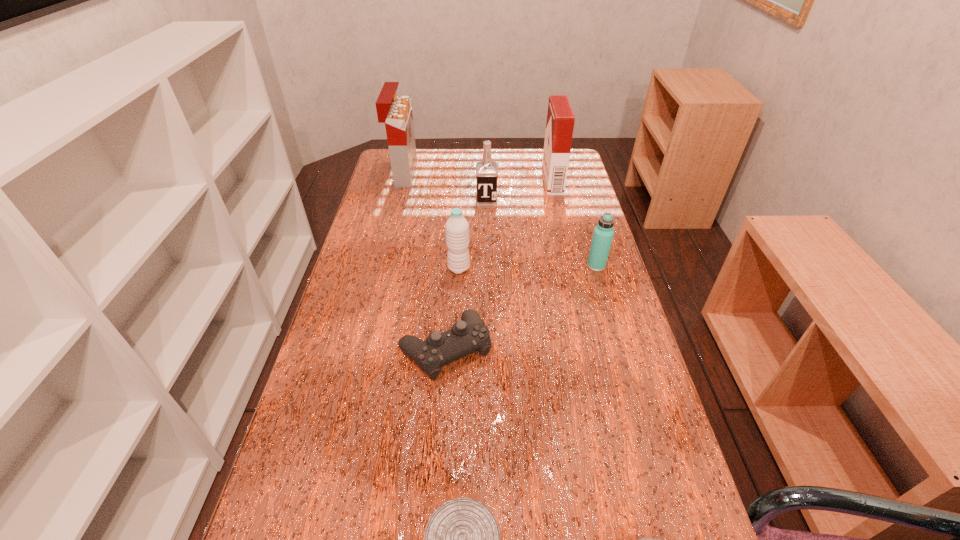
Locate an element on the screen. the leftmost object is located at coordinates (396, 112).

Identify the location of the right cigarette_case. This screenshot has height=540, width=960. (560, 118).

At what (x,y) coordinates should I click in order to perform the action: click on vodka. Please return your answer as a coordinate pair (x, y). Looking at the image, I should click on (486, 170).

You are a GUI agent. You are given a task and a screenshot of the screen. Output one action in this format:
    pyautogui.click(x=<x>, y=<y>)
    Task: Click on the water bottle
    The height and width of the screenshot is (540, 960).
    Given the screenshot: What is the action you would take?
    pyautogui.click(x=457, y=227)

At what (x,y) coordinates should I click in order to perform the action: click on thermos bottle. Please return your answer as a coordinate pair (x, y). Looking at the image, I should click on (603, 233).

You are a GUI agent. You are given a task and a screenshot of the screen. Output one action in this format:
    pyautogui.click(x=<x>, y=<y>)
    Task: Click on the control
    
    Given the screenshot: What is the action you would take?
    pyautogui.click(x=469, y=335)

Where is `the second shortest object`? This screenshot has width=960, height=540. the second shortest object is located at coordinates (469, 335).

The image size is (960, 540). Find the location of `vacant space located 0.120m with the lid open on the left cigarette_case`. vacant space located 0.120m with the lid open on the left cigarette_case is located at coordinates (446, 174).

The image size is (960, 540). I want to click on free space located 0.340m on the front-facing side of the right cigarette_case, so click(x=452, y=181).

Where is `free space located 0.320m on the front-facing side of the right cigarette_case`? Image resolution: width=960 pixels, height=540 pixels. free space located 0.320m on the front-facing side of the right cigarette_case is located at coordinates (457, 181).